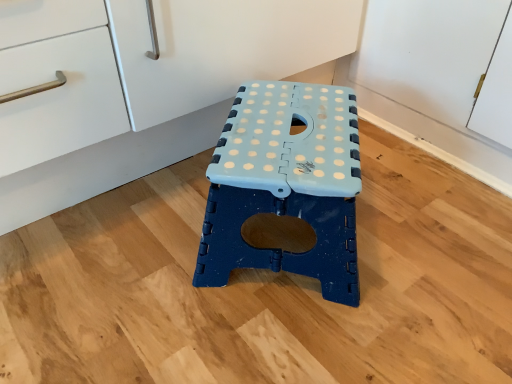
I want to click on blue plastic stool at center, so click(x=285, y=188).

Image resolution: width=512 pixels, height=384 pixels. Describe the element at coordinates (285, 188) in the screenshot. I see `blue plastic stool at center` at that location.

What is the approximate height of blue plastic stool at center?

The height of blue plastic stool at center is 8.64 inches.

Identify the location of blue plastic stool at center. This screenshot has width=512, height=384. [x=285, y=188].